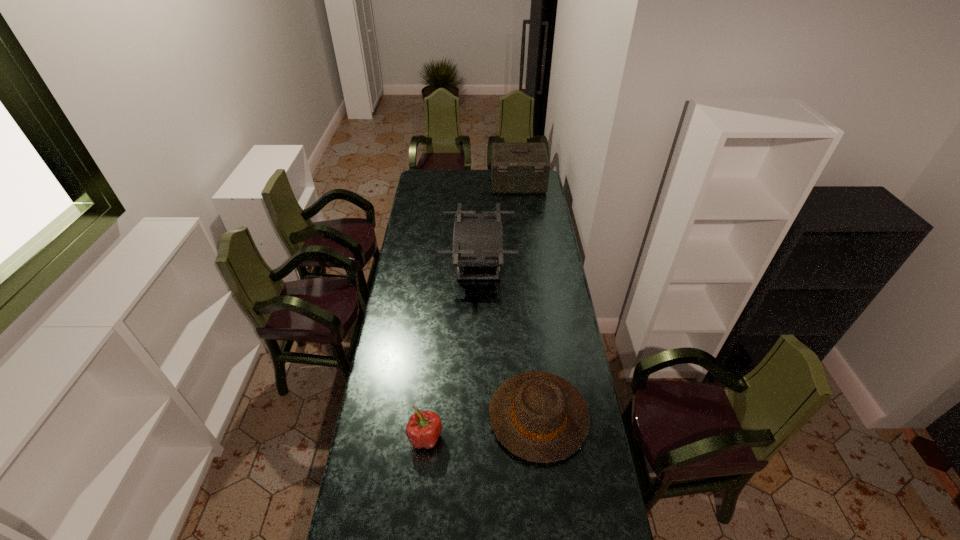
Locate an element on the screen. the first-aid kit is located at coordinates (516, 168).

Locate an element on the screen. The image size is (960, 540). the third nearest object is located at coordinates (477, 238).

Locate an element on the screen. This screenshot has width=960, height=540. drone is located at coordinates (477, 238).

The height and width of the screenshot is (540, 960). What are the coordinates of `cowboy hat` in the screenshot? It's located at (540, 417).

At what (x,y) coordinates should I click in order to perform the action: click on bell pepper. Please return your answer as a coordinate pair (x, y). This screenshot has height=540, width=960. Looking at the image, I should click on (424, 427).

The width and height of the screenshot is (960, 540). Find the location of `vacant space positioned 0.140m on the left of the farthest object`. vacant space positioned 0.140m on the left of the farthest object is located at coordinates (469, 183).

Locate an element on the screen. free space located with a camera mounted on the underside of the second tallest object is located at coordinates (536, 262).

You are a GUI agent. You are given a task and a screenshot of the screen. Output one action in this format:
    pyautogui.click(x=<x>, y=<y>)
    Task: Click on the free space located 0.180m on the front of the cowboy hat
    Image resolution: width=960 pixels, height=540 pixels.
    Given the screenshot: What is the action you would take?
    pyautogui.click(x=550, y=523)

Identify the location of vacant space situated on the left of the bell pepper. (389, 437).

Identify the location of object that is at the far edge. (516, 168).